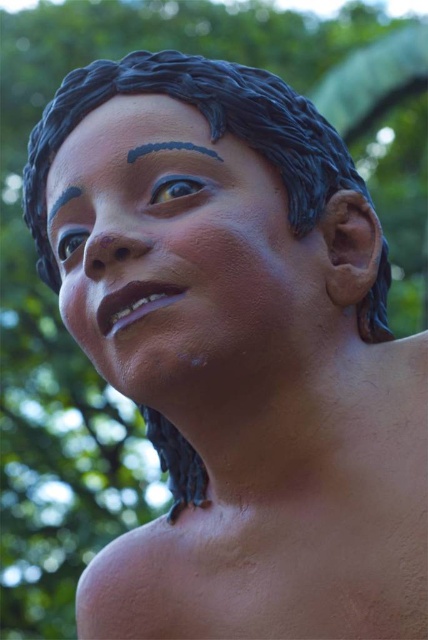
Question: Estimate the real-world distances between objects in this image. Which object is closer to the matte black forehead at upper center?

Choices:
 (A) black matte eyebrow at upper left
 (B) matte blue eye at upper left
 (C) matte clay neck at center
 (D) matte clay face at center

Answer: (A)

Question: Among these points, which one is nearest to the camera?

Choices:
 (A) (184, 188)
 (B) (148, 540)

Answer: (A)

Question: Where is matte clay neck at center located in relation to matte clay face at center in the image?

Choices:
 (A) below
 (B) above

Answer: (A)

Question: Which point appears closest to the camera in this image?

Choices:
 (A) (55, 212)
 (B) (127, 148)
 (C) (64, 244)
 (D) (296, 376)

Answer: (D)

Question: Is matte black forehead at upper center to the right of blue matte eyebrow at upper center from the viewer's perspective?

Choices:
 (A) yes
 (B) no

Answer: (B)

Question: Is matte clay face at center positioned behind blue matte eyebrow at upper center?

Choices:
 (A) yes
 (B) no

Answer: (B)